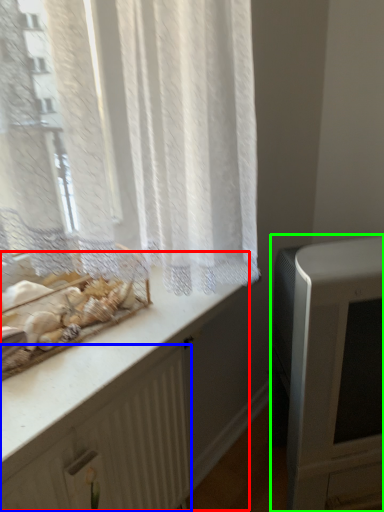
Question: Based on their relative distances, which object is nearer to counter (highlighted by a red box)? Choose from radiator (highlighted by a blue box) and appliance (highlighted by a green box).

Choices:
 (A) radiator
 (B) appliance

Answer: (A)